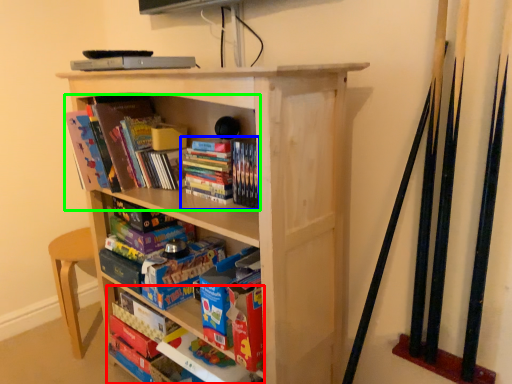
Question: Which object is the farthest from book (highlighted by a red box)? Choose among these: book (highlighted by a blue box) or book (highlighted by a green box).

Choices:
 (A) book
 (B) book

Answer: (B)